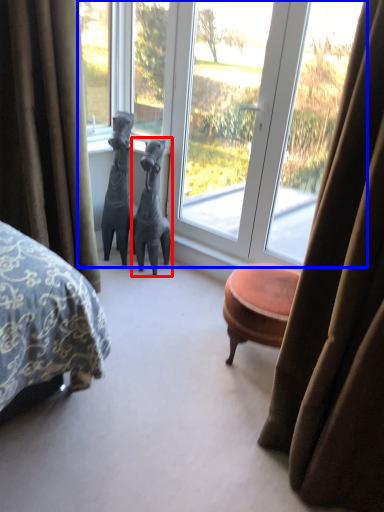
Question: Which of the following is the farthest to the observer, animal (highlighted by a red box) or window (highlighted by a blue box)?

Choices:
 (A) animal
 (B) window

Answer: (A)